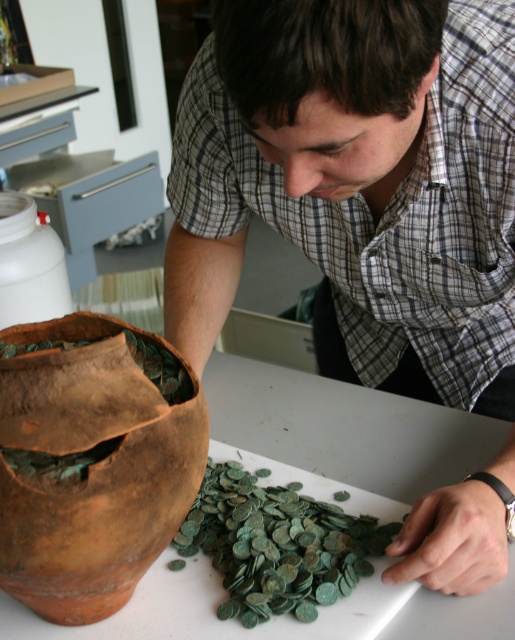
From the picture: You are organizing items on a shelf and need to place the matte brown vase at left and the white plastic bottle at left. If you want to arrange them from tallest to shortest, which should come first?

The matte brown vase at left is taller than the white plastic bottle at left, so it should come first in the arrangement from tallest to shortest.

You are organizing items on a table and need to place both the brown clay vase at lower left and the white plastic bottle at left. If you want to arrange them side by side without overlapping, which object should you place first to ensure enough space?

The brown clay vase at lower left has a larger width than the white plastic bottle at left, so you should place the brown clay vase at lower left first to ensure there is enough space for both when arranging them side by side.

You are standing in front of the table where the man is examining the coins. Where is the matte brown vase at left located relative to the table?

The matte brown vase at left is located at the coordinates (357, 182) relative to the table.